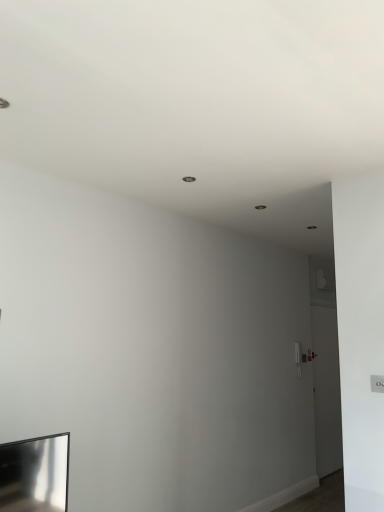
The width and height of the screenshot is (384, 512). What do you see at coordinates (326, 390) in the screenshot?
I see `white glossy door at right` at bounding box center [326, 390].

Image resolution: width=384 pixels, height=512 pixels. I want to click on white glossy door at right, so click(x=326, y=390).

Where is `white glossy door at right`? This screenshot has width=384, height=512. white glossy door at right is located at coordinates (326, 390).